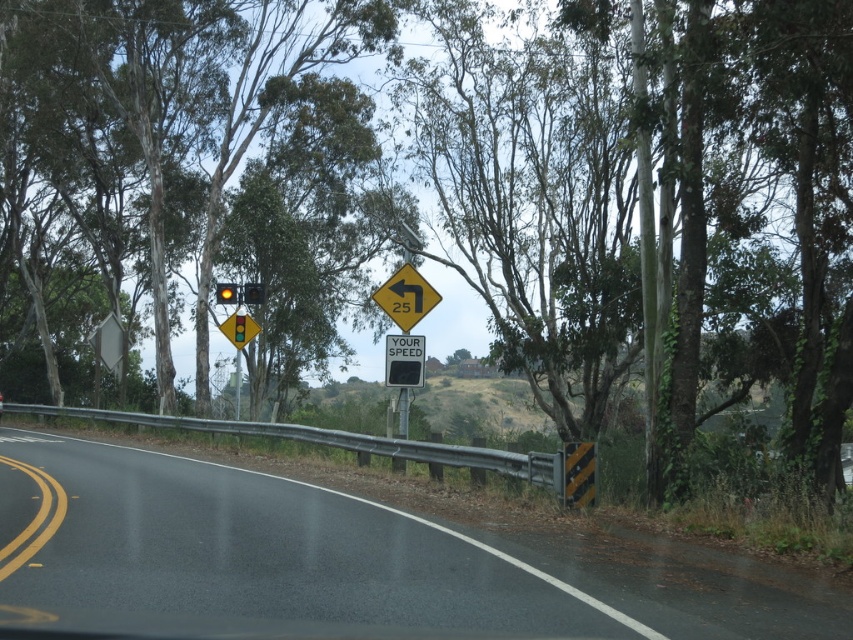
You are a driver approaching the road with a green leafy tree at upper left and a yellow reflective plastic at center. Which object would appear closer to you as you drive forward?

The yellow reflective plastic at center would appear closer because it is smaller in size compared to the green leafy tree at upper left, which is larger and likely farther away.

Consider the image. You are a driver approaching the road with a green leafy tree at upper left and a yellow plastic traffic light at upper center in your view. Which object appears bigger in your field of view?

The green leafy tree at upper left appears bigger in your field of view because it has a larger size compared to the yellow plastic traffic light at upper center.

From the picture: You are driving along the black asphalt road at center and see the yellow plastic traffic light at upper center. Which object is closer to you?

The black asphalt road at center is closer to you because it is shorter than the yellow plastic traffic light at upper center, meaning it is positioned nearer in the scene.